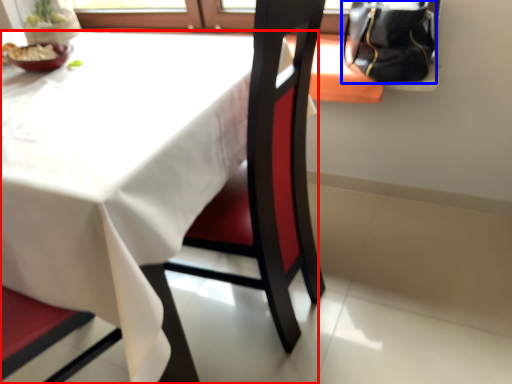
Question: Which of the following is the farthest to the observer, table (highlighted by a red box) or handbag (highlighted by a blue box)?

Choices:
 (A) table
 (B) handbag

Answer: (B)